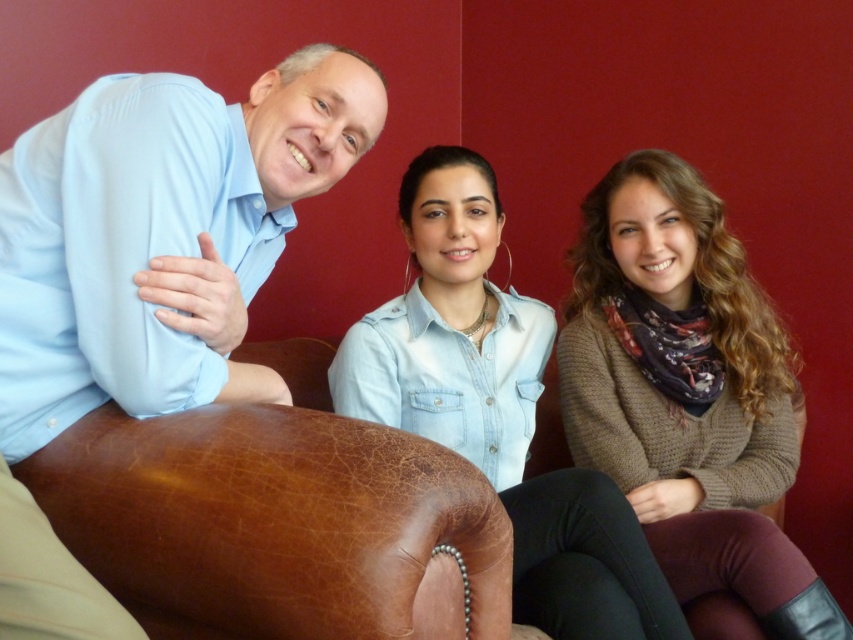
Question: Which point appears closest to the camera in this image?

Choices:
 (A) (433, 161)
 (B) (813, 588)

Answer: (B)

Question: Is knitted brown sweater at center wider than denim shirt at center?

Choices:
 (A) no
 (B) yes

Answer: (B)

Question: Which object is closer to the camera taking this photo?

Choices:
 (A) knitted brown sweater at center
 (B) light blue shirt at left

Answer: (B)

Question: Among these points, which one is nearest to the camera?

Choices:
 (A) [312, 83]
 (B) [746, 433]
 (C) [527, 481]

Answer: (A)

Question: Can you confirm if light blue shirt at left is positioned to the left of denim shirt at center?

Choices:
 (A) no
 (B) yes

Answer: (B)

Question: Does knitted brown sweater at center appear on the right side of denim shirt at center?

Choices:
 (A) no
 (B) yes

Answer: (B)